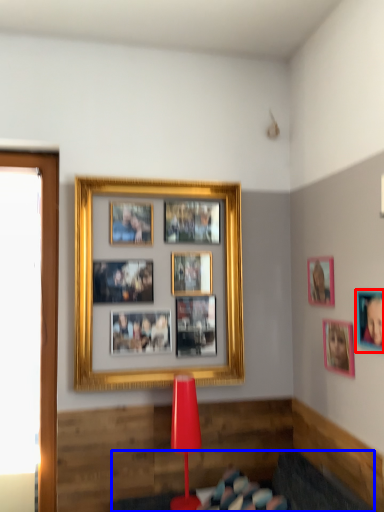
Question: Which object appears closest to the camera in this image, picture frame (highlighted by a red box) or furniture (highlighted by a blue box)?

Choices:
 (A) picture frame
 (B) furniture

Answer: (B)